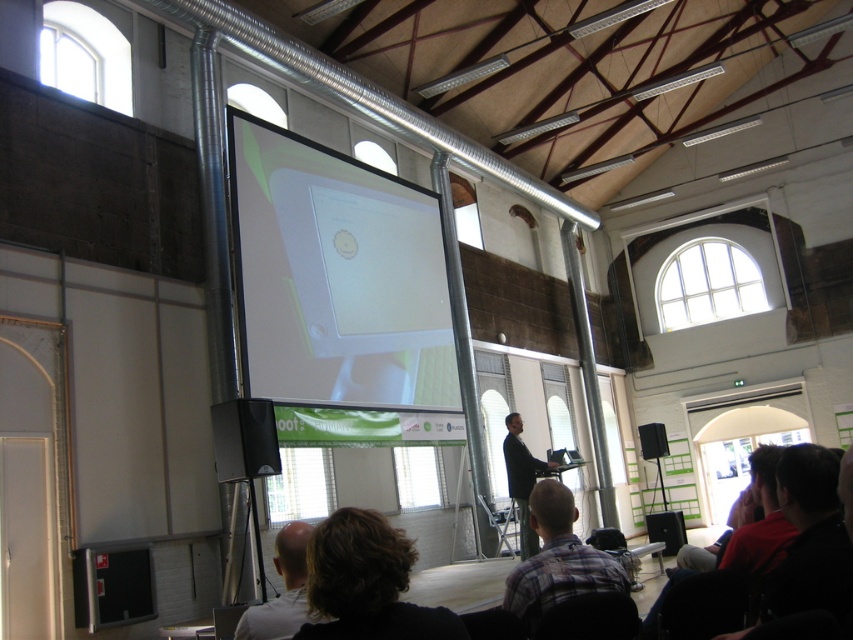
You are attending a presentation in the conference room and notice two items of interest. The first is the light brown hair at lower center, and the second is the dark brown leather jacket at center. Which of these items is shorter in height?

The light brown hair at lower center is shorter than the dark brown leather jacket at center according to the description.

You are an event planner setting up a new projector in the conference room. The projector has a maximum projection distance of 10 meters. Given the white glossy projector screen at center is located at point 0.458, 0.399 in the room, can you determine if the projector can reach the screen?

The white glossy projector screen at center is located at point (339, 292), but without knowing the exact dimensions of the room or the distance from the projector to the screen, it is impossible to determine if the projector can reach the screen based on the provided information.